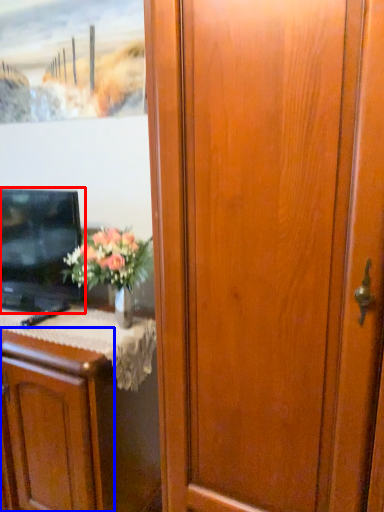
Question: Which of the following is the farthest to the observer, television (highlighted by a red box) or cabinetry (highlighted by a blue box)?

Choices:
 (A) television
 (B) cabinetry

Answer: (A)